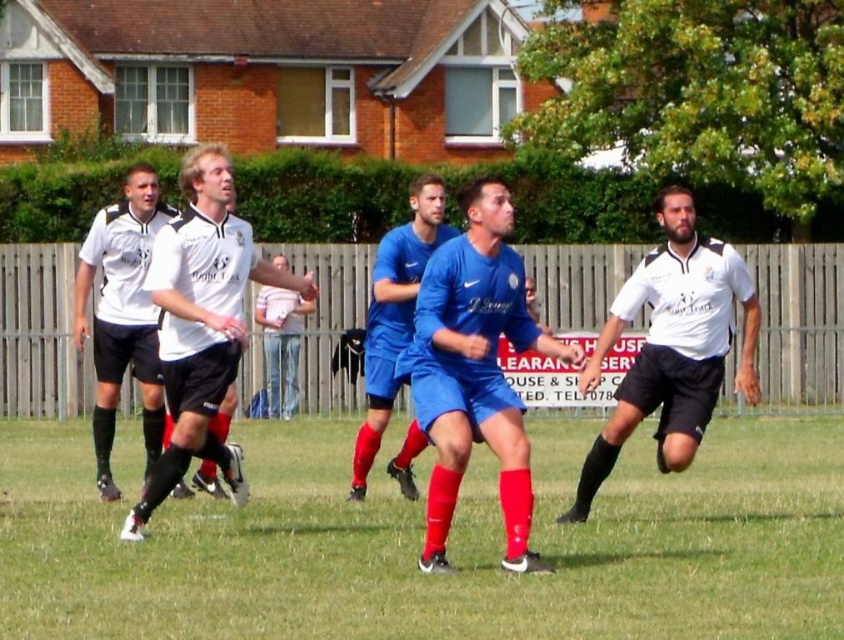
Question: Which of the following is the closest to the observer?

Choices:
 (A) (26, 541)
 (B) (691, 321)
 (C) (223, 332)

Answer: (C)

Question: Is the position of white matte jersey at center more distant than that of light blue jersey at center?

Choices:
 (A) no
 (B) yes

Answer: (A)

Question: Does white matte jersey at left appear on the right side of light blue jersey at center?

Choices:
 (A) yes
 (B) no

Answer: (B)

Question: Does green grass at center have a larger size compared to white matte jersey at center?

Choices:
 (A) yes
 (B) no

Answer: (A)

Question: Which point is farther to the camera?

Choices:
 (A) (291, 324)
 (B) (101, 419)
 (C) (626, 291)
 (D) (211, 316)

Answer: (A)

Question: Which point appears farthest from the camera in this image?

Choices:
 (A) (220, 205)
 (B) (399, 262)

Answer: (B)